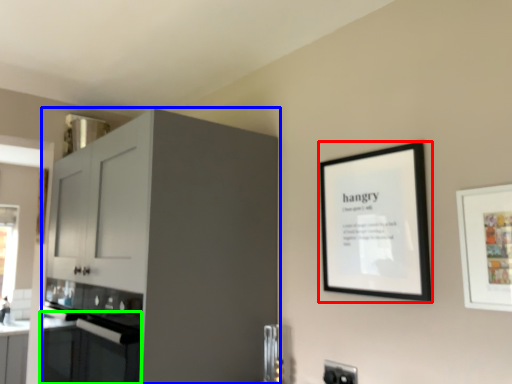
Question: Which is nearer to the picture frame (highlighted by a red box)? cabinetry (highlighted by a blue box) or oven (highlighted by a green box).

Choices:
 (A) cabinetry
 (B) oven

Answer: (A)